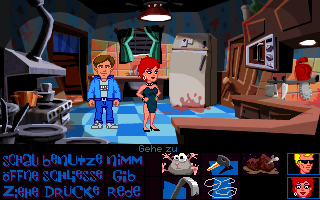
The height and width of the screenshot is (200, 320). I want to click on counter, so click(297, 123), click(219, 126), click(240, 124).